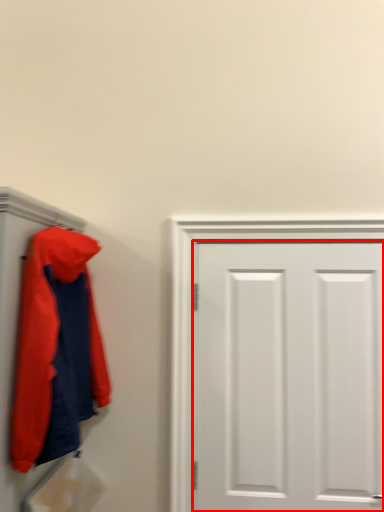
Question: From the image's perspective, what is the correct spatial relationship of door (annotated by the red box) in relation to jacket?

Choices:
 (A) below
 (B) above

Answer: (A)